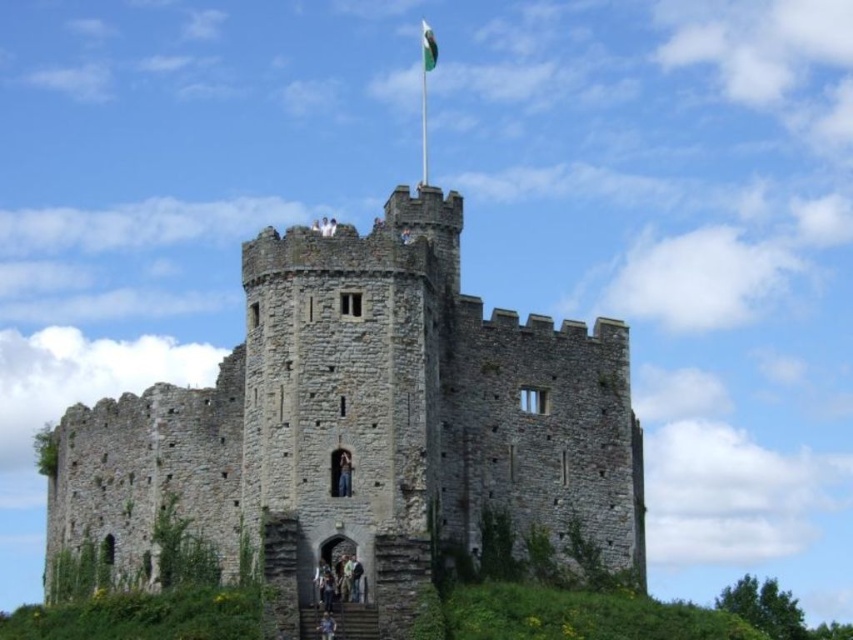
Does gray stone castle at center have a lesser width compared to green fabric flag at upper center?

In fact, gray stone castle at center might be wider than green fabric flag at upper center.

Is gray stone castle at center closer to camera compared to green fabric flag at upper center?

Yes, it is in front of green fabric flag at upper center.

You are a GUI agent. You are given a task and a screenshot of the screen. Output one action in this format:
    pyautogui.click(x=<x>, y=<y>)
    Task: Click on the gray stone castle at center
    This screenshot has width=853, height=640.
    Given the screenshot: What is the action you would take?
    click(x=364, y=422)

You are a GUI agent. You are given a task and a screenshot of the screen. Output one action in this format:
    pyautogui.click(x=<x>, y=<y>)
    Task: Click on the gray stone castle at center
    The width and height of the screenshot is (853, 640).
    Given the screenshot: What is the action you would take?
    pyautogui.click(x=364, y=422)